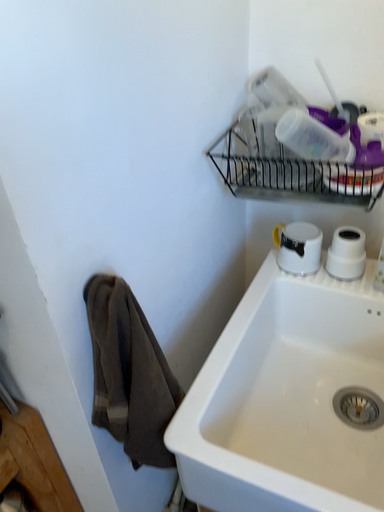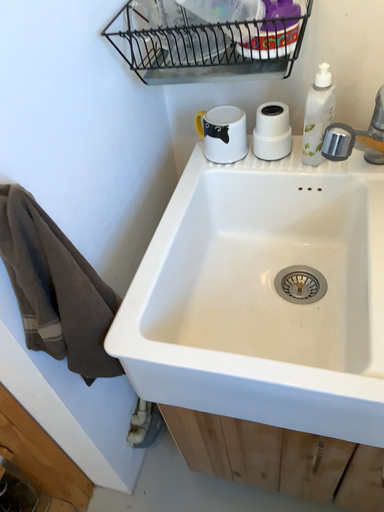
Question: Which way did the camera rotate in the video?

Choices:
 (A) rotated downward
 (B) rotated upward

Answer: (A)